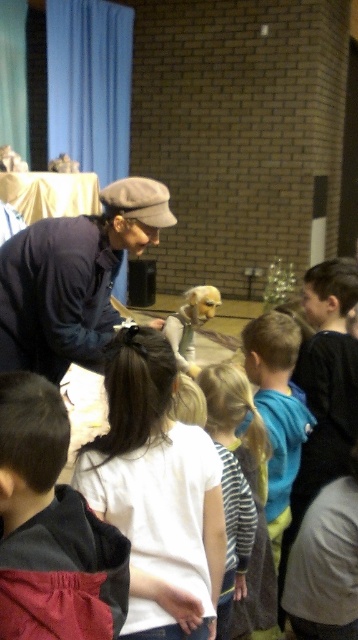
You are a photographer trying to capture a clear photo of both the matte blue shirt at center and the silvery metallic dog at center. Based on their positions, which object should you focus on first to ensure both are in frame?

The matte blue shirt at center might be wider than silvery metallic dog at center, so you should focus on the wider matte blue shirt at center first to ensure both fit within the frame.

Consider the image. You are a photographer taking a photo of the children in the scene. You notice two children wearing a matte blue shirt at center and a striped shirt at center. Which child should you focus on to ensure their full height is captured in the photo?

The matte blue shirt at center is not as tall as striped shirt at center, so focusing on the striped shirt at center would ensure the taller child is fully captured in the photo.